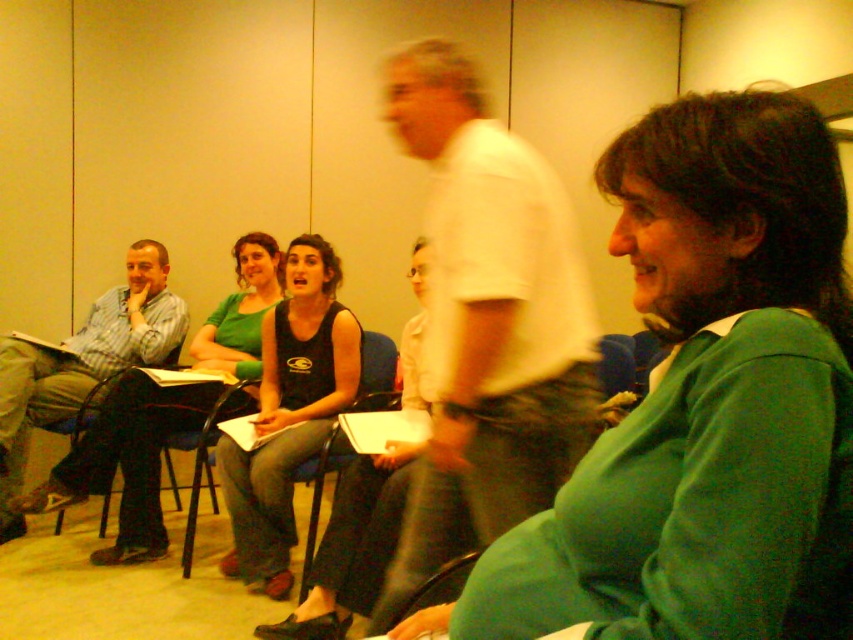
Question: Which object appears closest to the camera in this image?

Choices:
 (A) black sleeveless top at center
 (B) black fabric chair at center
 (C) black tank top at center

Answer: (A)

Question: Does striped cotton shirt at left appear over black sleeveless top at center?

Choices:
 (A) yes
 (B) no

Answer: (A)

Question: Which object is farther from the camera taking this photo?

Choices:
 (A) green matte sweater at center
 (B) black fabric chair at center

Answer: (B)

Question: Can you confirm if green matte sweater at center is thinner than black fabric chair at center?

Choices:
 (A) yes
 (B) no

Answer: (B)

Question: Is black sleeveless top at center further to camera compared to black fabric chair at center?

Choices:
 (A) no
 (B) yes

Answer: (A)

Question: Estimate the real-world distances between objects in this image. Which object is farther from the black sleeveless top at center?

Choices:
 (A) striped cotton shirt at left
 (B) green matte sweater at center
 (C) black fabric chair at center
 (D) black tank top at center

Answer: (B)